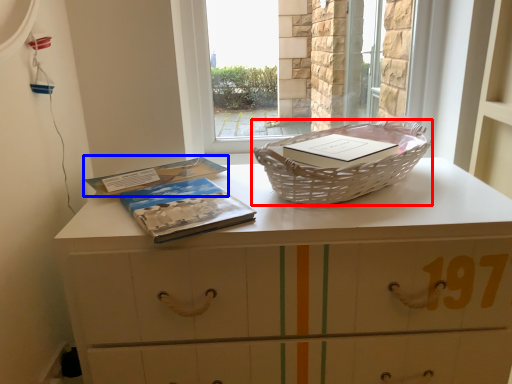
Question: Among these objects, which one is farthest to the camera, picnic basket (highlighted by a red box) or paperback book (highlighted by a blue box)?

Choices:
 (A) picnic basket
 (B) paperback book

Answer: (B)